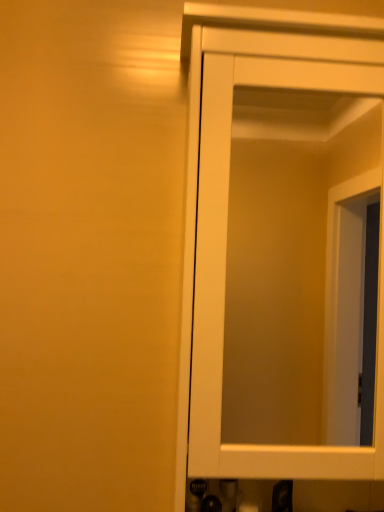
Question: Should I look upward or downward to see white matte cupboard at right?

Choices:
 (A) up
 (B) down

Answer: (B)